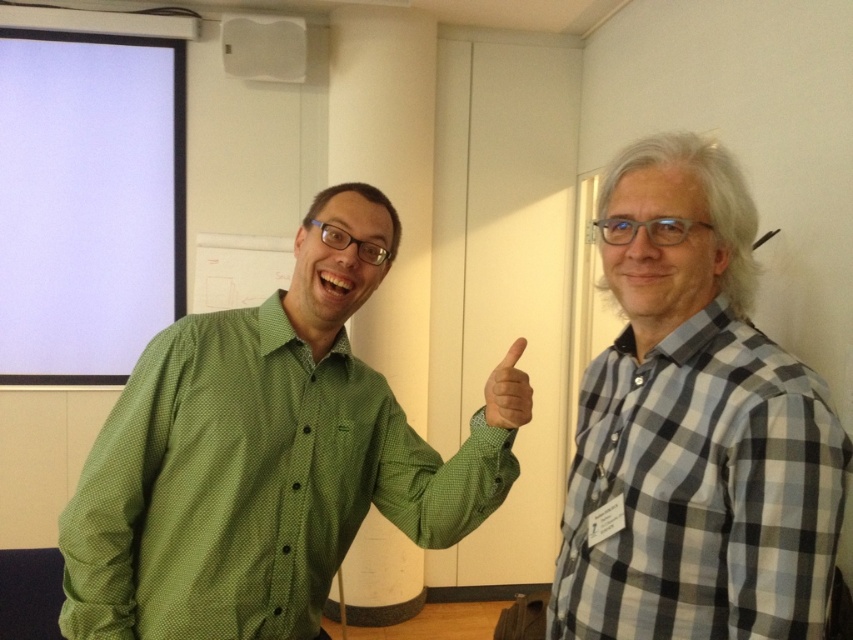
Which is in front, point (370, 412) or point (585, 392)?

Point (585, 392) is in front.

Does green dotted shirt at left come in front of gray checkered shirt at right?

No, it is behind gray checkered shirt at right.

Is point (71, 637) positioned after point (813, 582)?

Yes, it is behind point (813, 582).

Locate an element on the screen. The height and width of the screenshot is (640, 853). green dotted shirt at left is located at coordinates (262, 458).

Does green dotted shirt at left have a lesser width compared to green matte hand at center?

No, green dotted shirt at left is not thinner than green matte hand at center.

Who is more forward, (x=495, y=452) or (x=515, y=413)?

Point (x=515, y=413) is in front.

Locate an element on the screen. The image size is (853, 640). green dotted shirt at left is located at coordinates (262, 458).

Is gray checkered shirt at right smaller than green matte hand at center?

No, gray checkered shirt at right is not smaller than green matte hand at center.

Can you confirm if gray checkered shirt at right is positioned below green matte hand at center?

Yes.

Image resolution: width=853 pixels, height=640 pixels. Identify the location of gray checkered shirt at right. pyautogui.click(x=700, y=492).